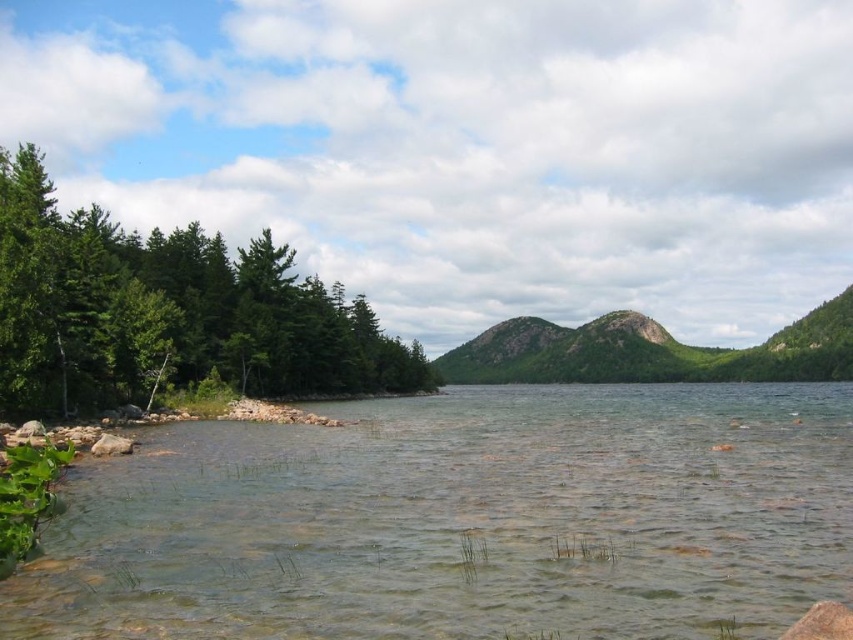
Question: In this image, where is clear water at lower left located relative to green leafy trees at left?

Choices:
 (A) below
 (B) above

Answer: (A)

Question: Which point is closer to the camera?

Choices:
 (A) (665, 371)
 (B) (715, 598)

Answer: (B)

Question: Where is clear water at lower left located in relation to green leafy trees at left in the image?

Choices:
 (A) right
 (B) left

Answer: (A)

Question: Which point is farther to the camera?

Choices:
 (A) (503, 364)
 (B) (549, 509)

Answer: (A)

Question: Can you confirm if clear water at lower left is bigger than green leafy trees at left?

Choices:
 (A) yes
 (B) no

Answer: (B)

Question: Which point is closer to the camera taking this photo?

Choices:
 (A) (578, 458)
 (B) (815, 378)

Answer: (A)